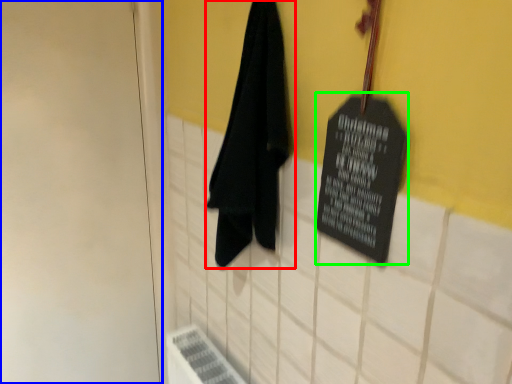
Question: Estimate the real-world distances between objects in this image. Which object is closer to towel (highlighted by a red box), door (highlighted by a blue box) or bulletin board (highlighted by a green box)?

Choices:
 (A) door
 (B) bulletin board

Answer: (B)